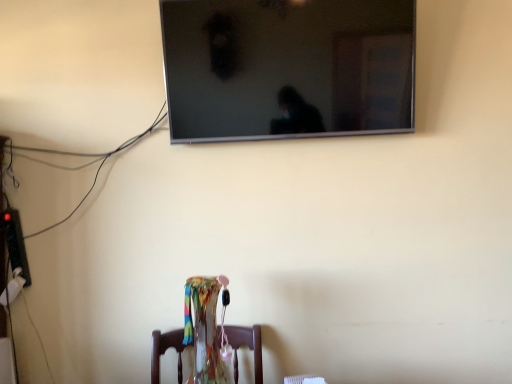
Question: Looking at the image, does transparent glass vase at center seem bigger or smaller compared to flat screen tv at upper center?

Choices:
 (A) small
 (B) big

Answer: (A)

Question: From the image's perspective, is transparent glass vase at center located above or below flat screen tv at upper center?

Choices:
 (A) above
 (B) below

Answer: (B)

Question: Is transparent glass vase at center wider or thinner than flat screen tv at upper center?

Choices:
 (A) thin
 (B) wide

Answer: (B)

Question: From a real-world perspective, relative to transparent glass vase at center, is flat screen tv at upper center vertically above or below?

Choices:
 (A) below
 (B) above

Answer: (B)

Question: Considering the positions of flat screen tv at upper center and transparent glass vase at center in the image, is flat screen tv at upper center taller or shorter than transparent glass vase at center?

Choices:
 (A) tall
 (B) short

Answer: (A)

Question: From the image's perspective, is flat screen tv at upper center above or below transparent glass vase at center?

Choices:
 (A) above
 (B) below

Answer: (A)

Question: Looking at the image, does flat screen tv at upper center seem bigger or smaller compared to transparent glass vase at center?

Choices:
 (A) small
 (B) big

Answer: (B)